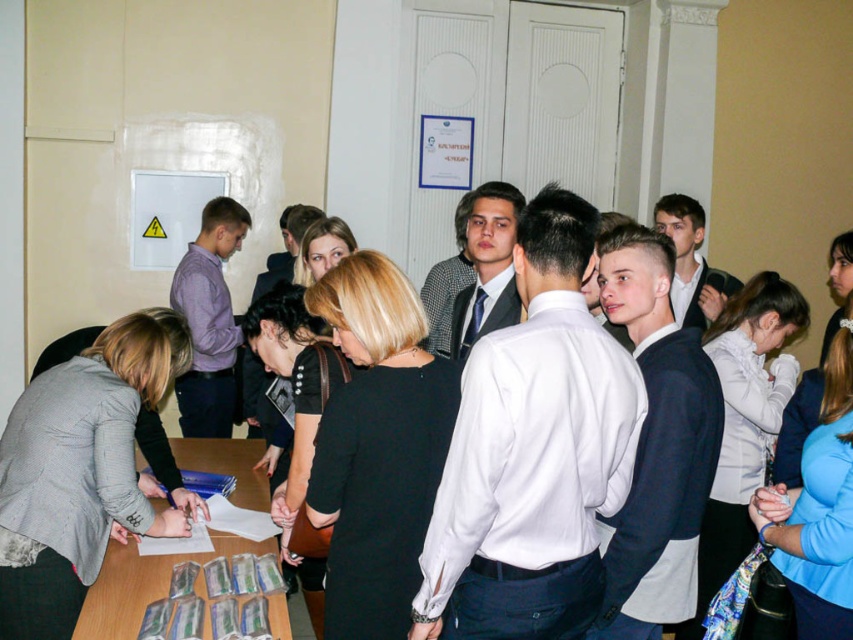
Question: Which of the following is the farthest from the observer?

Choices:
 (A) (10, 518)
 (B) (115, 554)

Answer: (B)

Question: Can you confirm if gray fabric jacket at lower left is positioned above wooden table at lower left?

Choices:
 (A) yes
 (B) no

Answer: (A)

Question: Does gray fabric jacket at lower left have a larger size compared to wooden table at lower left?

Choices:
 (A) no
 (B) yes

Answer: (B)

Question: Is gray fabric jacket at lower left above wooden table at lower left?

Choices:
 (A) no
 (B) yes

Answer: (B)